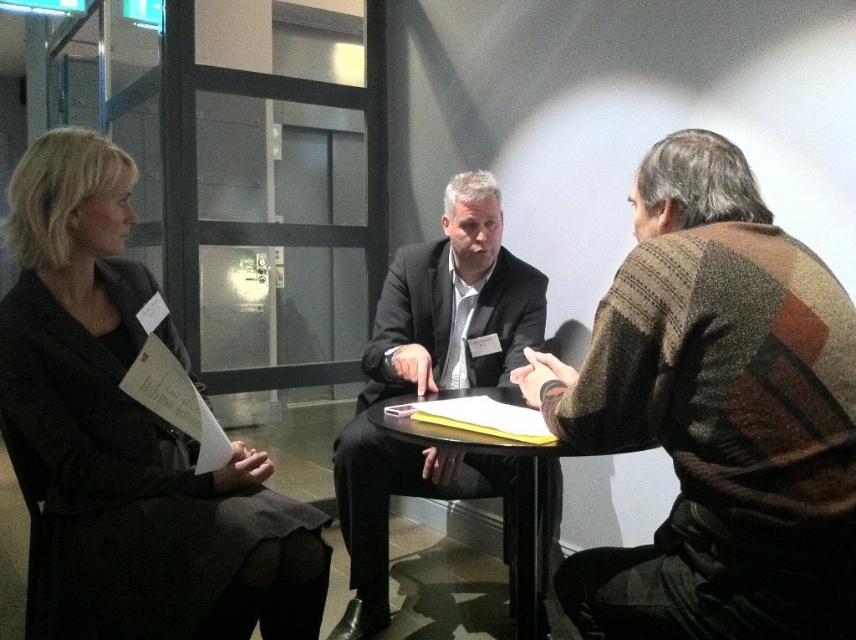
Can you confirm if striped wool sweater at right is positioned above matte black coat at left?

Yes.

Between striped wool sweater at right and matte black coat at left, which one has more height?

With more height is matte black coat at left.

Is point (746, 417) farther from camera compared to point (211, 620)?

No, it is not.

The height and width of the screenshot is (640, 856). I want to click on striped wool sweater at right, so click(x=715, y=413).

Between point (646, 208) and point (420, 355), which one is positioned behind?

The point (420, 355) is more distant.

Does striped wool sweater at right have a greater width compared to dark gray suit at center?

In fact, striped wool sweater at right might be narrower than dark gray suit at center.

Does point (670, 458) come closer to viewer compared to point (366, 488)?

Yes.

Where is `striped wool sweater at right`? striped wool sweater at right is located at coordinates (715, 413).

Is the position of striped wool sweater at right less distant than that of black glossy table at center?

Yes, striped wool sweater at right is closer to the viewer.

Does striped wool sweater at right appear under black glossy table at center?

Incorrect, striped wool sweater at right is not positioned below black glossy table at center.

Describe the element at coordinates (715, 413) in the screenshot. I see `striped wool sweater at right` at that location.

The image size is (856, 640). I want to click on striped wool sweater at right, so click(x=715, y=413).